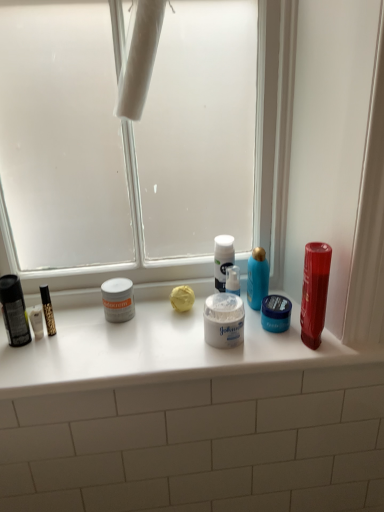
The height and width of the screenshot is (512, 384). What are the coordinates of `vacant region in front of white matte jar at center` in the screenshot? It's located at (231, 358).